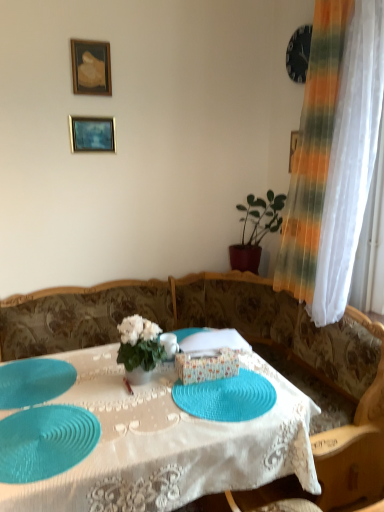
Question: Considering the relative sizes of gold-framed painting at upper left, arranged as the first picture frame when viewed from the top, and teal rubber placemat at lower left, positioned as the 1th glass plate in left-to-right order, in the image provided, is gold-framed painting at upper left, arranged as the first picture frame when viewed from the top, shorter than teal rubber placemat at lower left, positioned as the 1th glass plate in left-to-right order,?

Choices:
 (A) yes
 (B) no

Answer: (B)

Question: Can you confirm if gold-framed painting at upper left, which is the 2th picture frame from bottom to top, is positioned to the right of teal rubber placemat at lower left, acting as the third glass plate starting from the right?

Choices:
 (A) yes
 (B) no

Answer: (A)

Question: Does gold-framed painting at upper left, which is the 2th picture frame from bottom to top, appear on the left side of teal rubber placemat at lower left, positioned as the 1th glass plate in left-to-right order?

Choices:
 (A) no
 (B) yes

Answer: (A)

Question: From a real-world perspective, is gold-framed painting at upper left, arranged as the first picture frame when viewed from the top, under teal rubber placemat at lower left, acting as the third glass plate starting from the right?

Choices:
 (A) no
 (B) yes

Answer: (A)

Question: From a real-world perspective, is gold-framed painting at upper left, which is the 2th picture frame from bottom to top, on top of teal rubber placemat at lower left, acting as the third glass plate starting from the right?

Choices:
 (A) no
 (B) yes

Answer: (B)

Question: In terms of height, does white fabric flower at center look taller or shorter compared to teal rubber placemat at center?

Choices:
 (A) tall
 (B) short

Answer: (B)

Question: Does point (124, 360) appear closer or farther from the camera than point (316, 490)?

Choices:
 (A) farther
 (B) closer

Answer: (A)

Question: In terms of width, does white fabric flower at center look wider or thinner when compared to teal rubber placemat at center?

Choices:
 (A) wide
 (B) thin

Answer: (B)

Question: Considering the positions of white fabric flower at center and teal rubber placemat at center in the image, is white fabric flower at center bigger or smaller than teal rubber placemat at center?

Choices:
 (A) small
 (B) big

Answer: (A)

Question: Is teal woven placemat at center, which ranks as the first glass plate in right-to-left order, taller or shorter than matte gold picture frame at upper left, placed as the 1th picture frame when sorted from bottom to top?

Choices:
 (A) short
 (B) tall

Answer: (A)

Question: Is teal woven placemat at center, which ranks as the first glass plate in right-to-left order, spatially inside matte gold picture frame at upper left, marked as the 2th picture frame in a top-to-bottom arrangement, or outside of it?

Choices:
 (A) outside
 (B) inside

Answer: (A)

Question: From a real-world perspective, is teal woven placemat at center, which ranks as the first glass plate in right-to-left order, positioned above or below matte gold picture frame at upper left, marked as the 2th picture frame in a top-to-bottom arrangement?

Choices:
 (A) above
 (B) below

Answer: (B)

Question: Relative to matte gold picture frame at upper left, marked as the 2th picture frame in a top-to-bottom arrangement, is teal woven placemat at center, which ranks as the first glass plate in right-to-left order, in front or behind?

Choices:
 (A) behind
 (B) front

Answer: (B)

Question: Is point (165, 433) positioned closer to the camera than point (258, 263)?

Choices:
 (A) closer
 (B) farther

Answer: (A)

Question: In the image, is teal rubber placemat at center on the left side or the right side of green matte plant at right?

Choices:
 (A) right
 (B) left

Answer: (B)